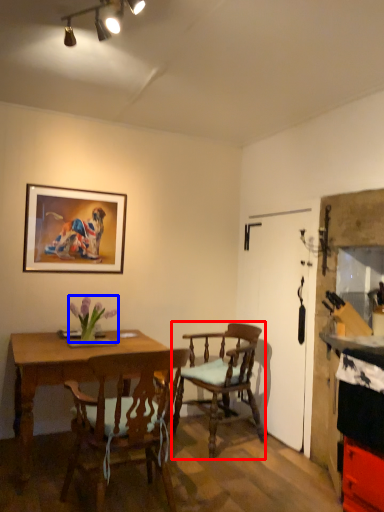
Question: Which of the following is the closest to the observer, chair (highlighted by a red box) or flower (highlighted by a blue box)?

Choices:
 (A) chair
 (B) flower

Answer: (B)